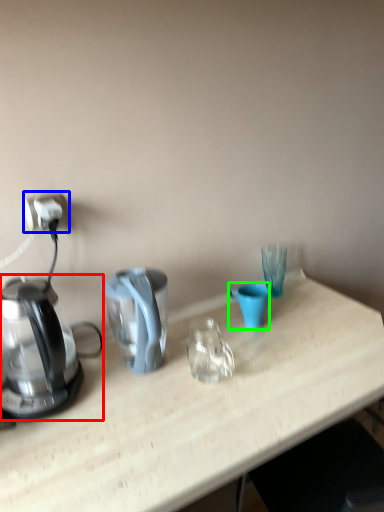
Question: Estimate the real-world distances between objects in this image. Which object is closer to kettle (highlighted by a red box), power outlet (highlighted by a blue box) or coffee cup (highlighted by a green box)?

Choices:
 (A) power outlet
 (B) coffee cup

Answer: (A)